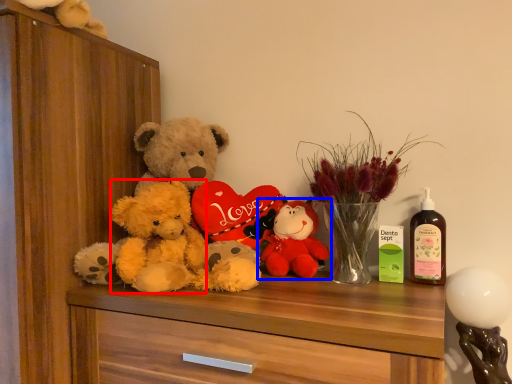
Question: Which object appears farthest to the camera in this image, teddy (highlighted by a red box) or toy (highlighted by a blue box)?

Choices:
 (A) teddy
 (B) toy

Answer: (B)